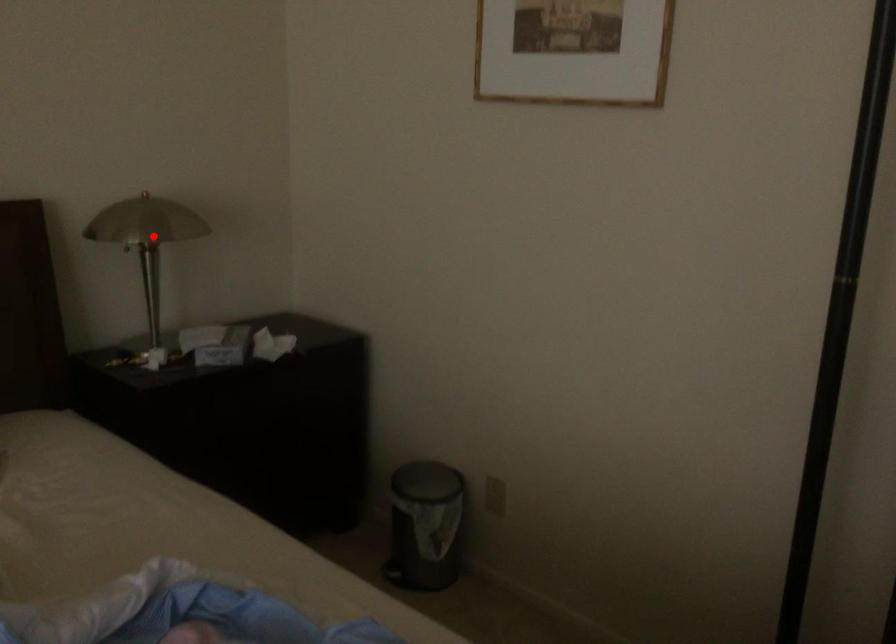
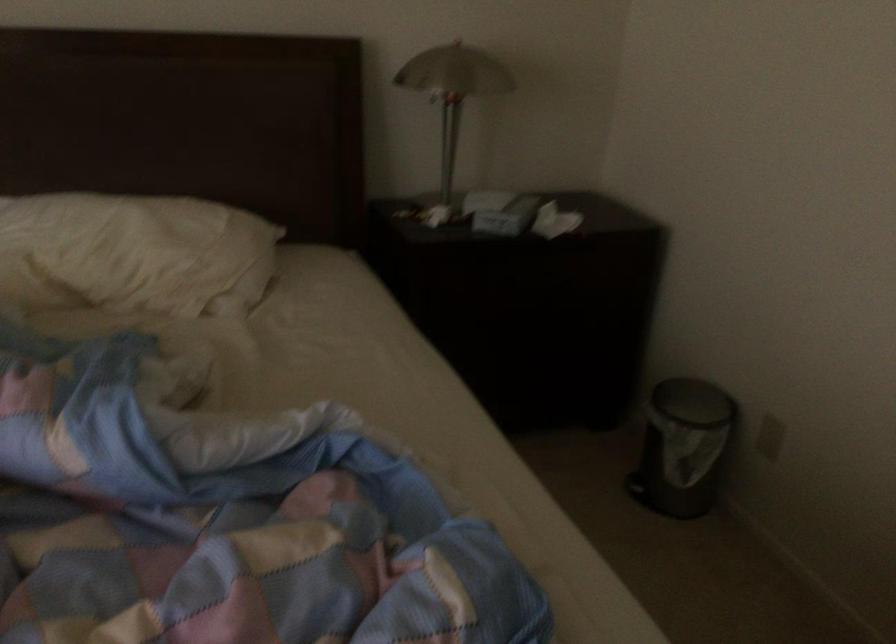
Where in the second image is the point corresponding to the highlighted location from the first image?

(453, 91)